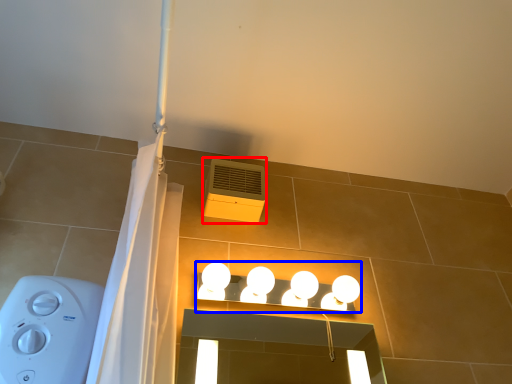
Question: Which point is further to the camera, air conditioning (highlighted by a red box) or lamp (highlighted by a blue box)?

Choices:
 (A) air conditioning
 (B) lamp

Answer: (A)